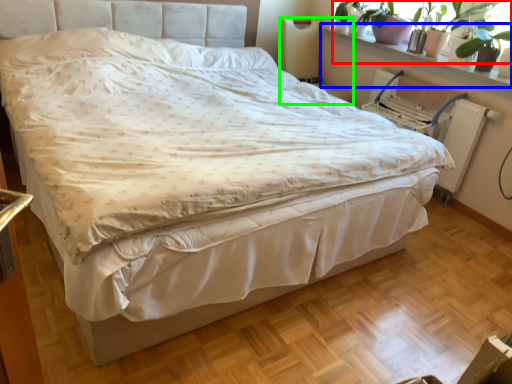
Question: Which is farther away from plant (highlighted by a red box)? window sill (highlighted by a blue box) or swivel chair (highlighted by a green box)?

Choices:
 (A) window sill
 (B) swivel chair

Answer: (B)